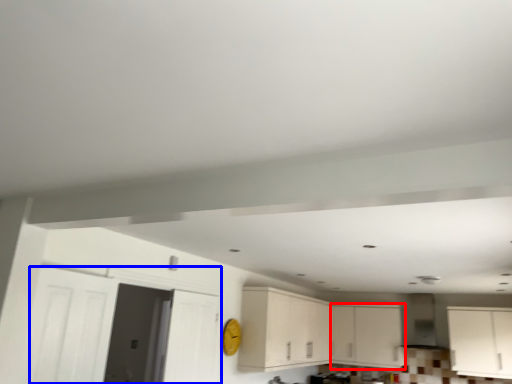
Question: Which of the following is the farthest to the observer, cabinetry (highlighted by a red box) or door (highlighted by a blue box)?

Choices:
 (A) cabinetry
 (B) door

Answer: (A)